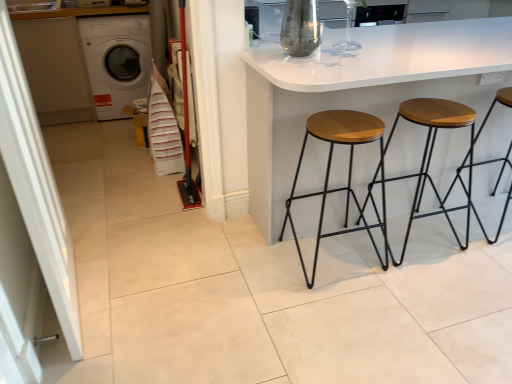
Identify the location of vacant space to the right of woodenmaterial/texturestool at center, the 1th stool from the left. Image resolution: width=512 pixels, height=384 pixels. (418, 277).